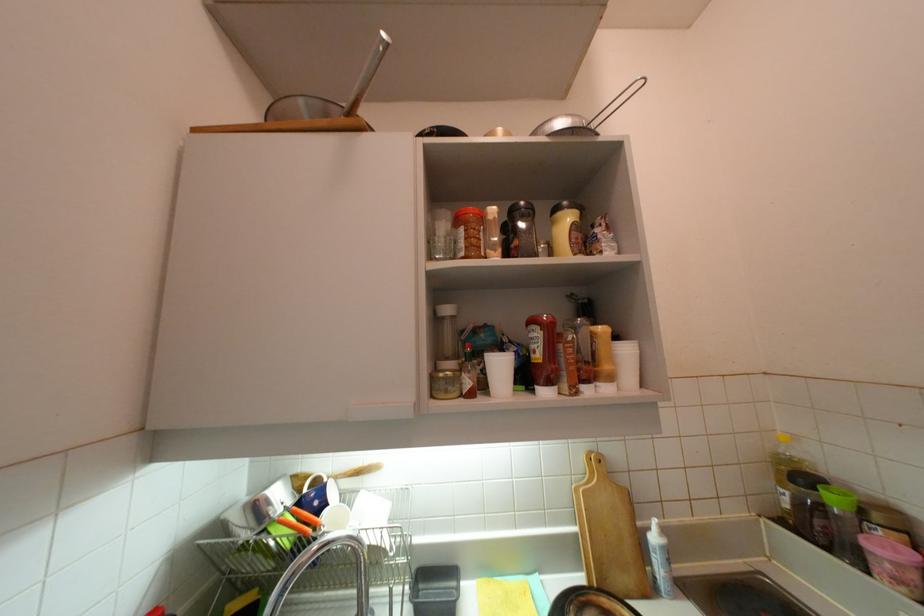
Which object does [660,561] point to?

It corresponds to the small sauce bottle in the image.